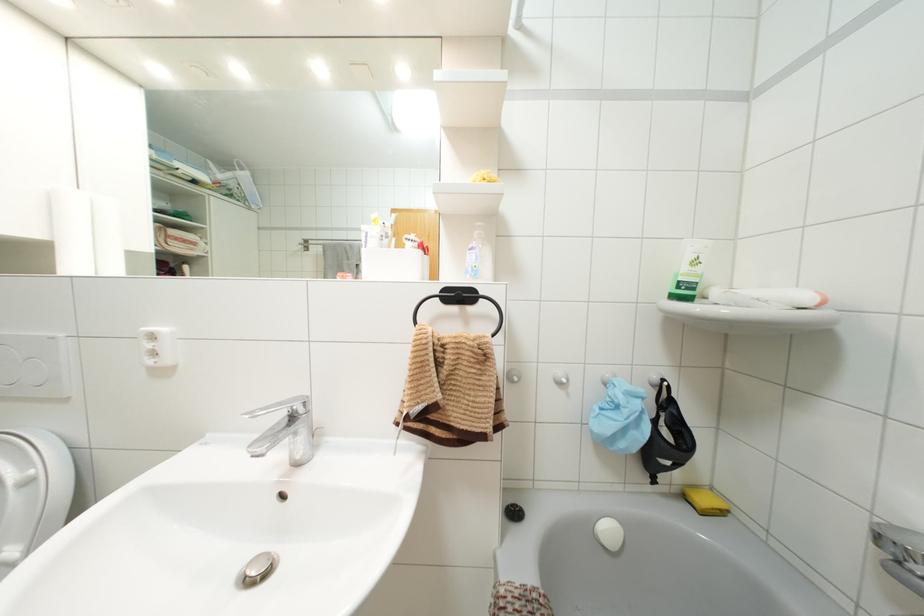
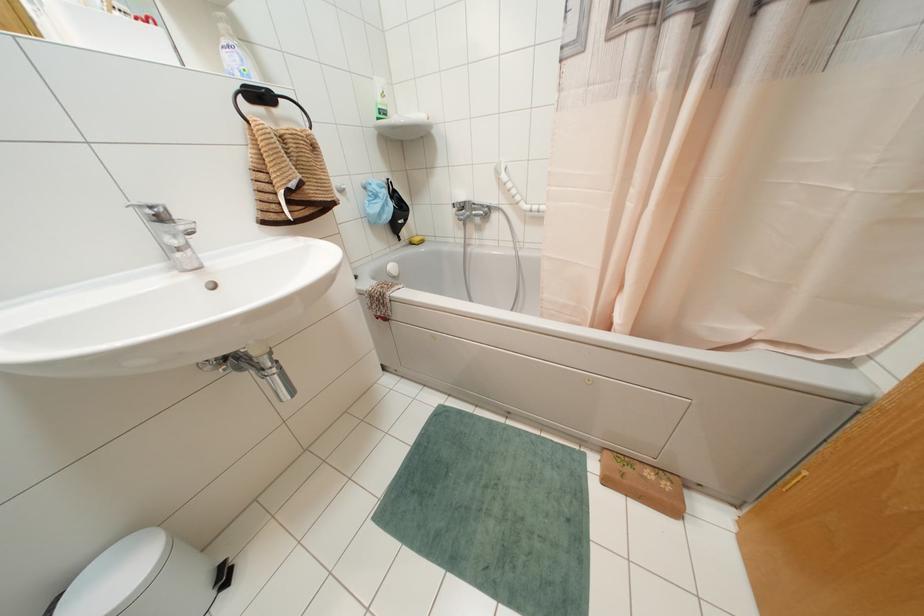
Based on the continuous images, in which direction is the camera rotating?

The rotation direction of the camera is right-down.